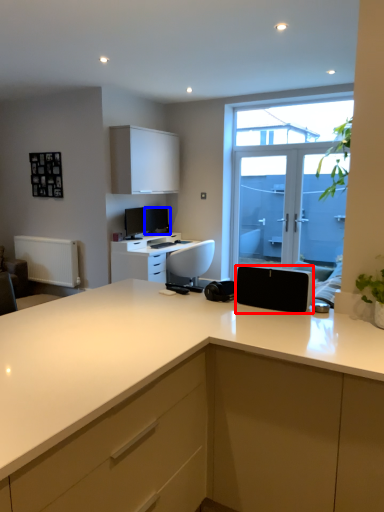
Question: Which of the following is the closest to the observer, appliance (highlighted by a red box) or computer monitor (highlighted by a blue box)?

Choices:
 (A) appliance
 (B) computer monitor

Answer: (A)